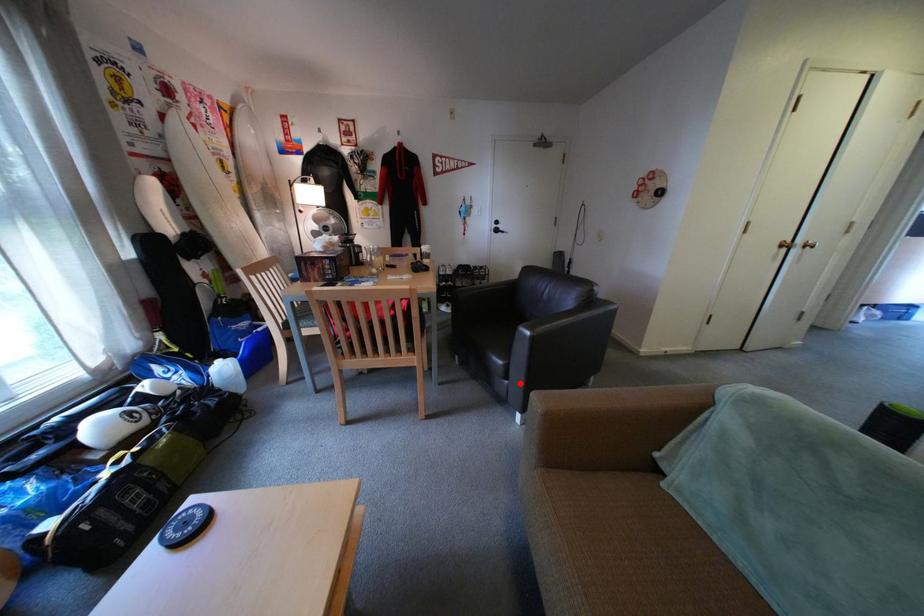
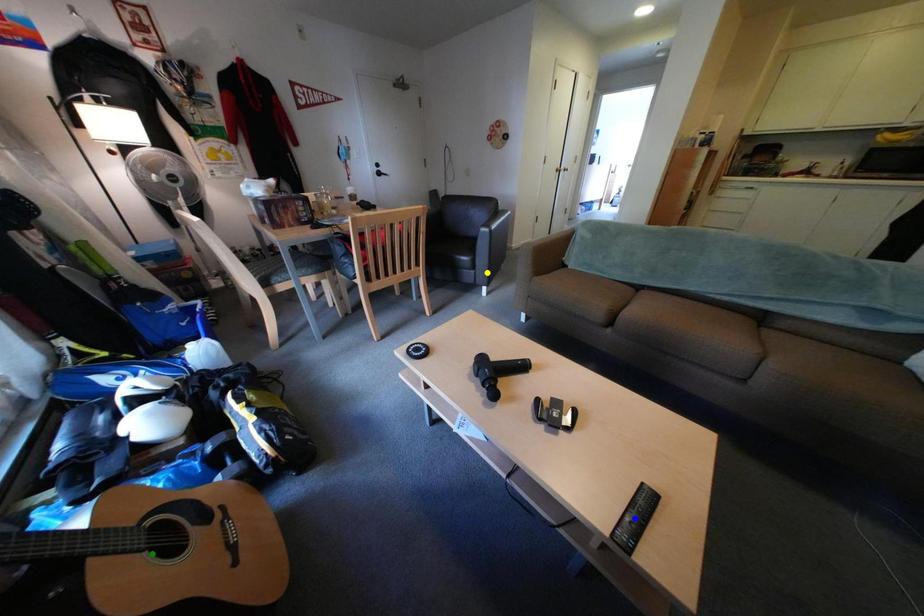
Question: I am providing you with two images of the same scene from different viewpoints. A red point is marked on the first image. You are given multiple points on the second image. Which mark in image 2 goes with the point in image 1?

Choices:
 (A) green point
 (B) yellow point
 (C) blue point

Answer: (B)